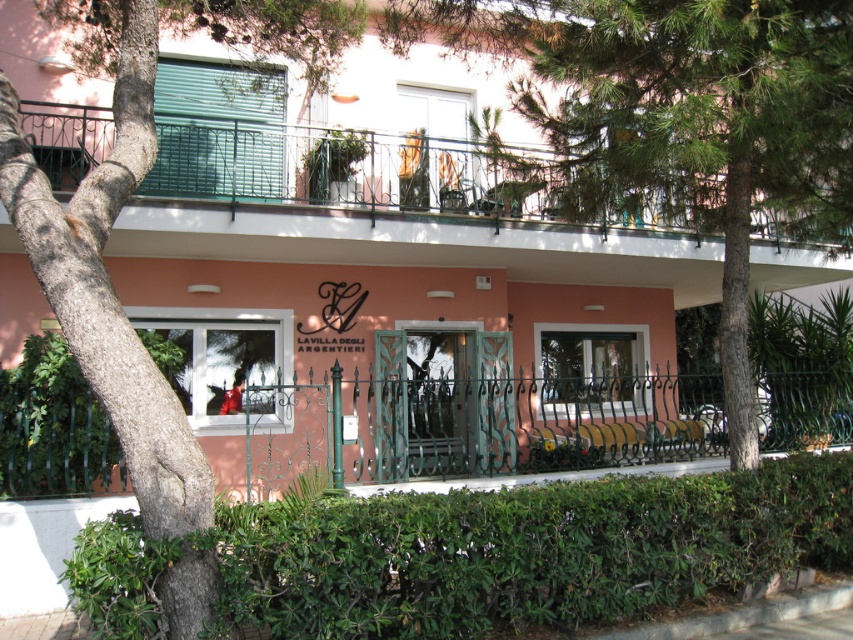
Between green leafy hedge at lower center and green textured bark at left, which one has more height?

green leafy hedge at lower center

Does green leafy hedge at lower center appear under green textured bark at left?

Yes.

Who is more forward, [263,509] or [349,13]?

Point [263,509] is more forward.

You are a GUI agent. You are given a task and a screenshot of the screen. Output one action in this format:
    pyautogui.click(x=<x>, y=<y>)
    Task: Click on the green leafy hedge at lower center
    Image resolution: width=853 pixels, height=640 pixels.
    Given the screenshot: What is the action you would take?
    pyautogui.click(x=524, y=552)

Does green leafy hedge at lower center lie in front of green leafy hedge at lower left?

Yes, it is in front of green leafy hedge at lower left.

What do you see at coordinates (524, 552) in the screenshot?
I see `green leafy hedge at lower center` at bounding box center [524, 552].

Is point (325, 522) positioned before point (170, 364)?

Yes, point (325, 522) is in front of point (170, 364).

At what (x,y) coordinates should I click in order to perform the action: click on green leafy hedge at lower center. Please return your answer as a coordinate pair (x, y). Looking at the image, I should click on (524, 552).

Who is higher up, green leafy hedge at lower center or metallic railing at upper center?

metallic railing at upper center

Is point (780, 464) positioned behind point (100, 108)?

No, (780, 464) is in front of (100, 108).

At what (x,y) coordinates should I click in order to perform the action: click on green leafy hedge at lower center. Please return your answer as a coordinate pair (x, y). This screenshot has height=640, width=853. Looking at the image, I should click on (524, 552).